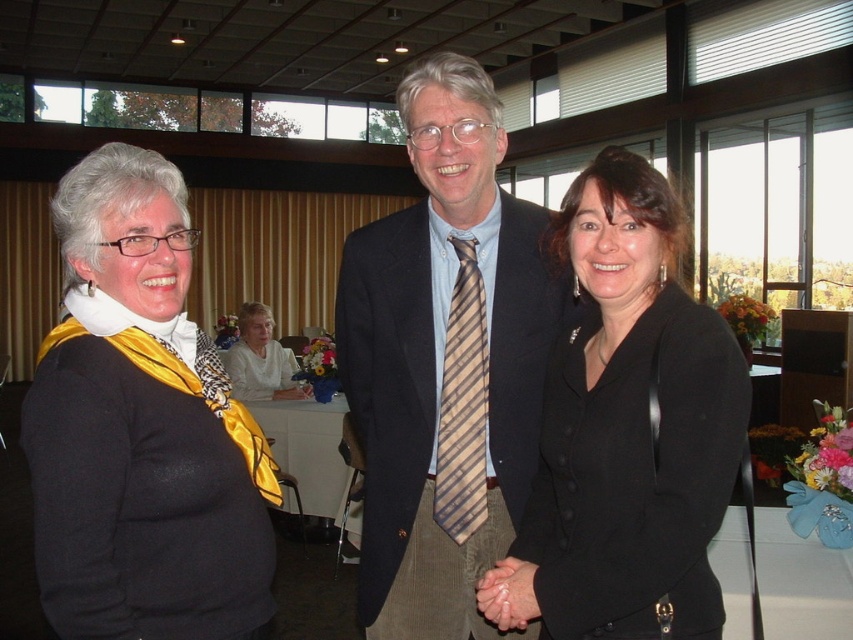
Question: Is striped tie at center above black matte blazer at center?

Choices:
 (A) yes
 (B) no

Answer: (A)

Question: Which is nearer to the brown striped tie at center?

Choices:
 (A) black matte blazer at center
 (B) striped tie at center
 (C) white fabric at center
 (D) black matte scarf at left

Answer: (B)

Question: Which point is closer to the camera?

Choices:
 (A) (637, 292)
 (B) (482, 476)
 (C) (277, 349)
 (D) (172, 234)

Answer: (D)

Question: Which point appears farthest from the camera in this image?

Choices:
 (A) (448, 461)
 (B) (245, 323)
 (C) (639, 580)

Answer: (B)

Question: Is black matte scarf at left smaller than brown striped tie at center?

Choices:
 (A) no
 (B) yes

Answer: (A)

Question: Can you confirm if striped tie at center is bigger than brown striped tie at center?

Choices:
 (A) yes
 (B) no

Answer: (A)